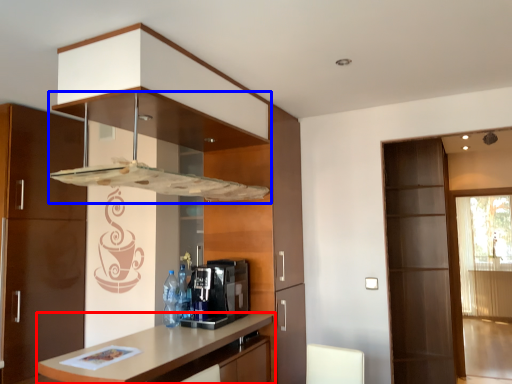
Question: Which of the following is the closest to the observer, countertop (highlighted by a red box) or exhaust hood (highlighted by a blue box)?

Choices:
 (A) countertop
 (B) exhaust hood

Answer: (A)